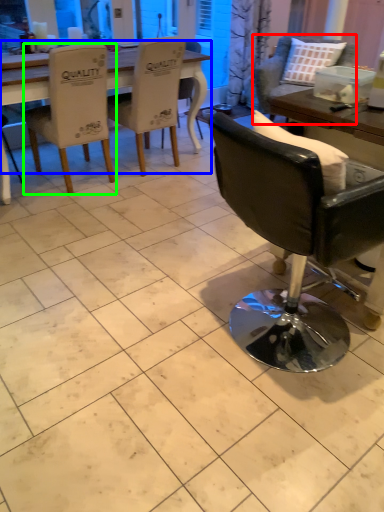
Question: Based on their relative distances, which object is nearer to chair (highlighted by a red box)? Choose from table (highlighted by a blue box) and chair (highlighted by a green box).

Choices:
 (A) table
 (B) chair

Answer: (A)